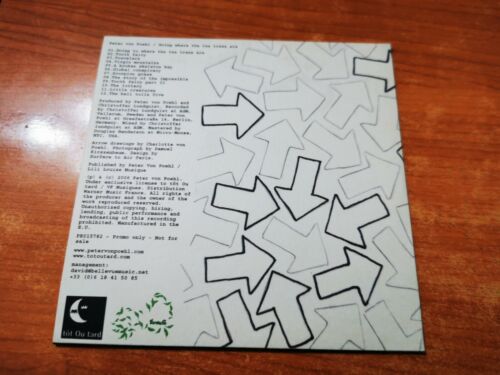
Identify the location of table. [x=446, y=170].